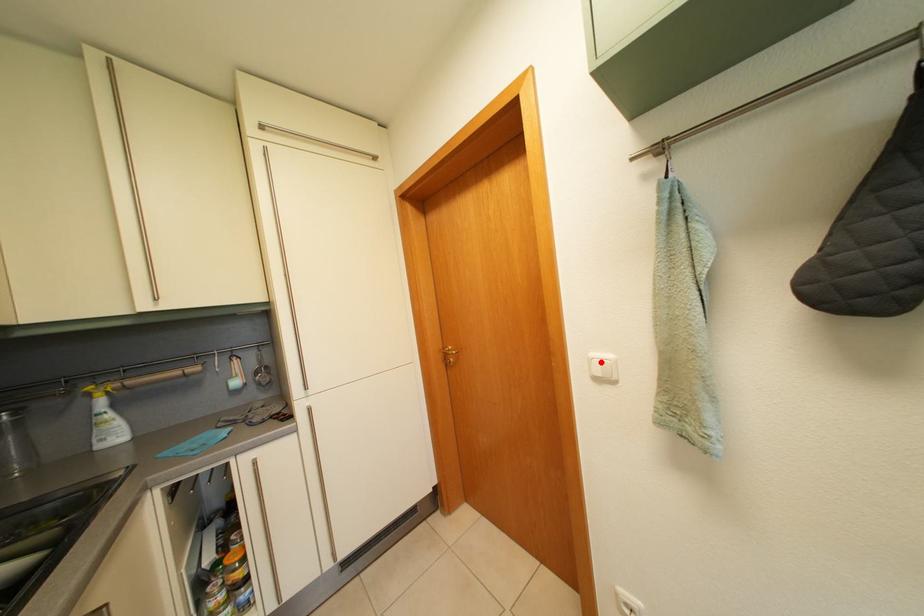
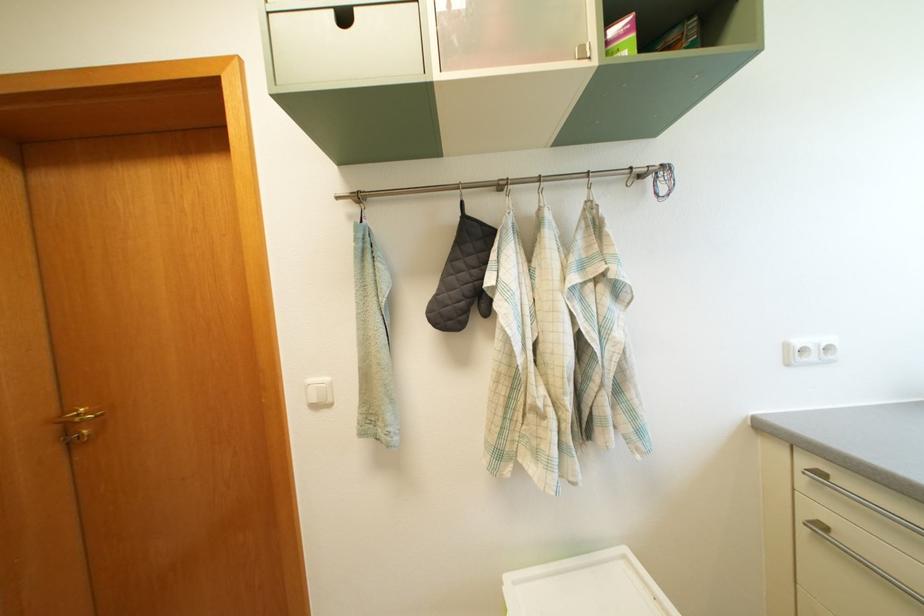
The point at the highlighted location is marked in the first image. Where is the corresponding point in the second image?

(318, 387)